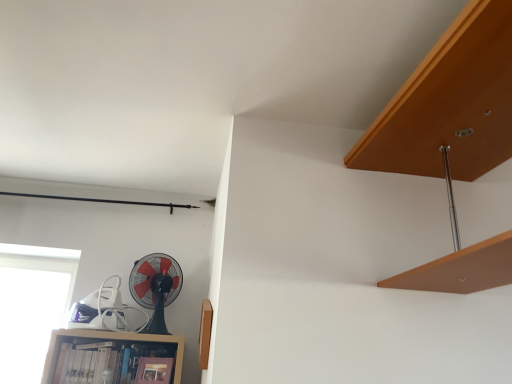
You are a GUI agent. You are given a task and a screenshot of the screen. Output one action in this format:
    pyautogui.click(x=<x>, y=<y>)
    Task: Click on the transparent glass window at lower left
    This screenshot has width=512, height=384.
    Given the screenshot: What is the action you would take?
    pyautogui.click(x=32, y=306)

Considering the sizes of black plastic fan at lower left and wooden bookshelf at lower left in the image, is black plastic fan at lower left taller or shorter than wooden bookshelf at lower left?

Clearly, black plastic fan at lower left is taller compared to wooden bookshelf at lower left.

In the scene shown: Which is more to the left, black plastic fan at lower left or wooden bookshelf at lower left?

From the viewer's perspective, wooden bookshelf at lower left appears more on the left side.

How far apart are black plastic fan at lower left and wooden bookshelf at lower left?

black plastic fan at lower left and wooden bookshelf at lower left are 30.37 centimeters apart from each other.

Does black plastic fan at lower left turn towards wooden bookshelf at lower left?

No, black plastic fan at lower left is not aimed at wooden bookshelf at lower left.

Does wooden bookshelf at lower left come in front of black plastic fan at lower left?

Yes.

Looking at their sizes, would you say wooden bookshelf at lower left is wider or thinner than black plastic fan at lower left?

In the image, wooden bookshelf at lower left appears to be more narrow than black plastic fan at lower left.

Can you confirm if wooden bookshelf at lower left is positioned to the right of black plastic fan at lower left?

Incorrect, wooden bookshelf at lower left is not on the right side of black plastic fan at lower left.

Does wooden bookshelf at lower left turn towards black plastic fan at lower left?

No, wooden bookshelf at lower left is not oriented towards black plastic fan at lower left.

Are black plastic fan at lower left and transparent glass window at lower left making contact?

No, black plastic fan at lower left is not beside transparent glass window at lower left.

Which of these two, black plastic fan at lower left or transparent glass window at lower left, is bigger?

With larger size is transparent glass window at lower left.

From the image's perspective, is black plastic fan at lower left below transparent glass window at lower left?

Actually, black plastic fan at lower left appears above transparent glass window at lower left in the image.

How many degrees apart are the facing directions of black plastic fan at lower left and transparent glass window at lower left?

They differ by 1.01 degrees in their facing directions.

Measure the distance from wooden bookshelf at lower left to transparent glass window at lower left.

The distance of wooden bookshelf at lower left from transparent glass window at lower left is 18.85 inches.

Does wooden bookshelf at lower left appear on the left side of transparent glass window at lower left?

No.

Is wooden bookshelf at lower left further to the viewer compared to transparent glass window at lower left?

No, it is in front of transparent glass window at lower left.

In the scene shown: From a real-world perspective, which is physically above, wooden bookshelf at lower left or transparent glass window at lower left?

transparent glass window at lower left.

Which of these two, transparent glass window at lower left or wooden bookshelf at lower left, is wider?

transparent glass window at lower left.

Considering the positions of points (42, 337) and (117, 367), is point (42, 337) closer to camera compared to point (117, 367)?

No, it is not.

This screenshot has height=384, width=512. I want to click on cabinet in front of the transparent glass window at lower left, so click(112, 357).

Is transparent glass window at lower left in front of or behind wooden bookshelf at lower left in the image?

Clearly, transparent glass window at lower left is behind wooden bookshelf at lower left.

From a real-world perspective, is transparent glass window at lower left physically located above or below black plastic fan at lower left?

Clearly, from a real-world perspective, transparent glass window at lower left is below black plastic fan at lower left.

From their relative heights in the image, would you say transparent glass window at lower left is taller or shorter than black plastic fan at lower left?

transparent glass window at lower left is taller than black plastic fan at lower left.

Which object is positioned more to the left, transparent glass window at lower left or black plastic fan at lower left?

transparent glass window at lower left is more to the left.

From the image's perspective, is transparent glass window at lower left positioned above or below black plastic fan at lower left?

Based on their image positions, transparent glass window at lower left is located beneath black plastic fan at lower left.

Image resolution: width=512 pixels, height=384 pixels. In the image, there is a wooden bookshelf at lower left. In order to click on mechanical fan above it (from the image's perspective) in this screenshot , I will do `click(155, 287)`.

This screenshot has width=512, height=384. Identify the location of cabinet lying below the black plastic fan at lower left (from the image's perspective). point(112,357).

When comparing their distances from wooden bookshelf at lower left, does transparent glass window at lower left or black plastic fan at lower left seem further?

transparent glass window at lower left is further to wooden bookshelf at lower left.

When comparing their distances from transparent glass window at lower left, does wooden bookshelf at lower left or black plastic fan at lower left seem further?

black plastic fan at lower left is positioned further to the anchor transparent glass window at lower left.

Looking at the image, which one is located further to black plastic fan at lower left, wooden bookshelf at lower left or transparent glass window at lower left?

transparent glass window at lower left is further to black plastic fan at lower left.

Looking at the image, which one is located closer to black plastic fan at lower left, transparent glass window at lower left or wooden bookshelf at lower left?

wooden bookshelf at lower left is positioned closer to the anchor black plastic fan at lower left.

Estimate the real-world distances between objects in this image. Which object is closer to wooden bookshelf at lower left, black plastic fan at lower left or transparent glass window at lower left?

The object closer to wooden bookshelf at lower left is black plastic fan at lower left.

Estimate the real-world distances between objects in this image. Which object is further from transparent glass window at lower left, black plastic fan at lower left or wooden bookshelf at lower left?

Based on the image, black plastic fan at lower left appears to be further to transparent glass window at lower left.

Locate an element on the screen. cabinet situated between transparent glass window at lower left and black plastic fan at lower left from left to right is located at coordinates (112, 357).